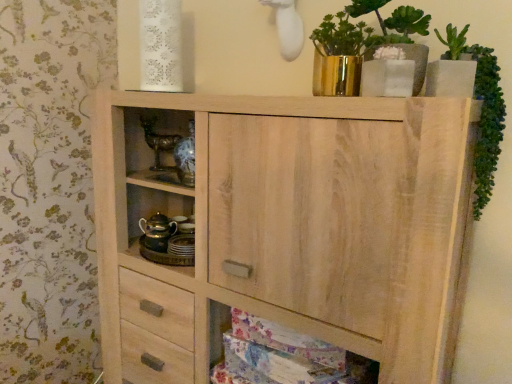
Question: Should I look upward or downward to see natural wood cabinet at lower center?

Choices:
 (A) down
 (B) up

Answer: (A)

Question: From a real-world perspective, is gold reflective vase at upper center on gold metallic teapot at center left?

Choices:
 (A) no
 (B) yes

Answer: (B)

Question: Is gold reflective vase at upper center positioned beyond the bounds of gold metallic teapot at center left?

Choices:
 (A) no
 (B) yes

Answer: (B)

Question: From the image's perspective, would you say gold reflective vase at upper center is shown under gold metallic teapot at center left?

Choices:
 (A) yes
 (B) no

Answer: (B)

Question: Is gold reflective vase at upper center closer to the viewer compared to gold metallic teapot at center left?

Choices:
 (A) yes
 (B) no

Answer: (A)

Question: Is gold metallic teapot at center left a part of gold reflective vase at upper center?

Choices:
 (A) yes
 (B) no

Answer: (B)

Question: Does gold reflective vase at upper center have a larger size compared to gold metallic teapot at center left?

Choices:
 (A) yes
 (B) no

Answer: (A)

Question: Would you say gold metallic teapot at center left is a long distance from gold reflective vase at upper center?

Choices:
 (A) yes
 (B) no

Answer: (B)

Question: From the image's perspective, is gold metallic teapot at center left below gold reflective vase at upper center?

Choices:
 (A) no
 (B) yes

Answer: (B)

Question: Considering the relative sizes of gold metallic teapot at center left and gold reflective vase at upper center in the image provided, is gold metallic teapot at center left shorter than gold reflective vase at upper center?

Choices:
 (A) yes
 (B) no

Answer: (A)

Question: Does gold metallic teapot at center left have a greater width compared to gold reflective vase at upper center?

Choices:
 (A) no
 (B) yes

Answer: (B)

Question: Is the position of gold metallic teapot at center left less distant than that of gold reflective vase at upper center?

Choices:
 (A) no
 (B) yes

Answer: (A)

Question: From a real-world perspective, is gold metallic teapot at center left located higher than gold reflective vase at upper center?

Choices:
 (A) no
 (B) yes

Answer: (A)

Question: Can you confirm if green leafy plant at upper right is shorter than natural wood cabinet at lower center?

Choices:
 (A) no
 (B) yes

Answer: (A)